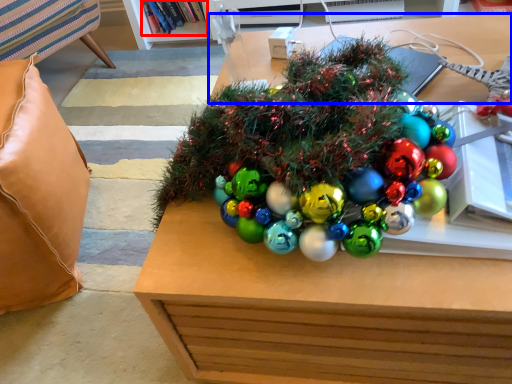
Question: Among these objects, which one is nearest to the camera, book (highlighted by a red box) or table (highlighted by a blue box)?

Choices:
 (A) book
 (B) table

Answer: (B)